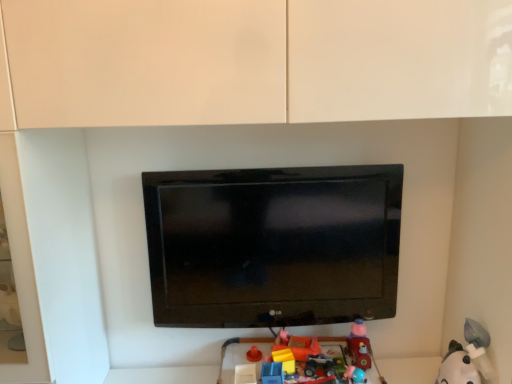
Locate an element on the screen. This screenshot has height=384, width=512. free spot above rubberized plastic toy at lower center, which is the second toy in left-to-right order (from a real-world perspective) is located at coordinates (305, 359).